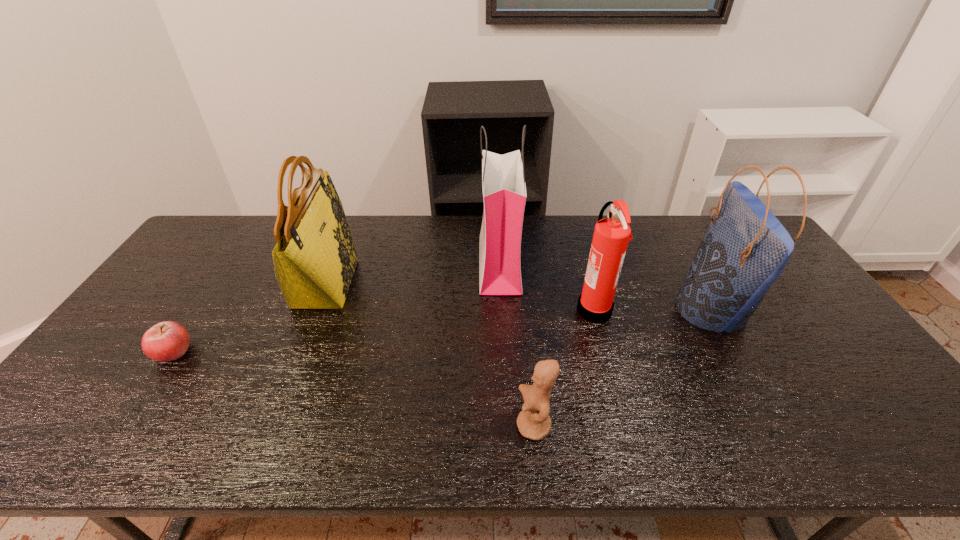
The height and width of the screenshot is (540, 960). I want to click on free space located on the front-facing side of the left shopping bag, so click(x=430, y=264).

Locate an element on the screen. The width and height of the screenshot is (960, 540). free space located 0.300m on the back of the right shopping bag is located at coordinates (662, 222).

Where is `blank space located on the front-facing side of the tote bag`? blank space located on the front-facing side of the tote bag is located at coordinates tap(399, 284).

Find the location of a particular element. vacant region located with the nozzle aimed from the second object from right to left is located at coordinates (484, 309).

At what (x,y) coordinates should I click in order to perform the action: click on free region located 0.210m with the nozzle aimed from the second object from right to left. Please return your answer as a coordinate pair (x, y). The image size is (960, 540). Looking at the image, I should click on (504, 309).

Locate an element on the screen. blank space located 0.380m with the nozzle aimed from the second object from right to left is located at coordinates (446, 309).

Find the location of a particular element. free space located 0.310m on the front-facing side of the figurine is located at coordinates (380, 426).

This screenshot has height=540, width=960. Find the location of `free spot located on the front-facing side of the figurine`. free spot located on the front-facing side of the figurine is located at coordinates (407, 426).

You are a GUI agent. You are given a task and a screenshot of the screen. Output one action in this format:
    pyautogui.click(x=<x>, y=<y>)
    Task: Click on the vacant point located 0.130m on the front-facing side of the figurine
    
    Given the screenshot: What is the action you would take?
    pyautogui.click(x=460, y=426)

Identify the location of vacant space situated on the right of the leftmost object. (322, 351).